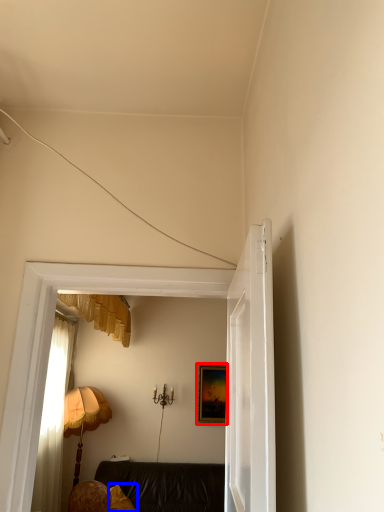
Question: Which point is closer to the camera, picture frame (highlighted by a red box) or pillow (highlighted by a blue box)?

Choices:
 (A) picture frame
 (B) pillow

Answer: (B)